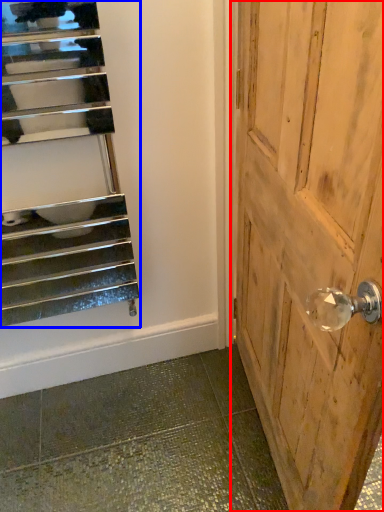
Question: Which object appears closest to the camera in this image, door (highlighted by a red box) or stairs (highlighted by a blue box)?

Choices:
 (A) door
 (B) stairs

Answer: (A)